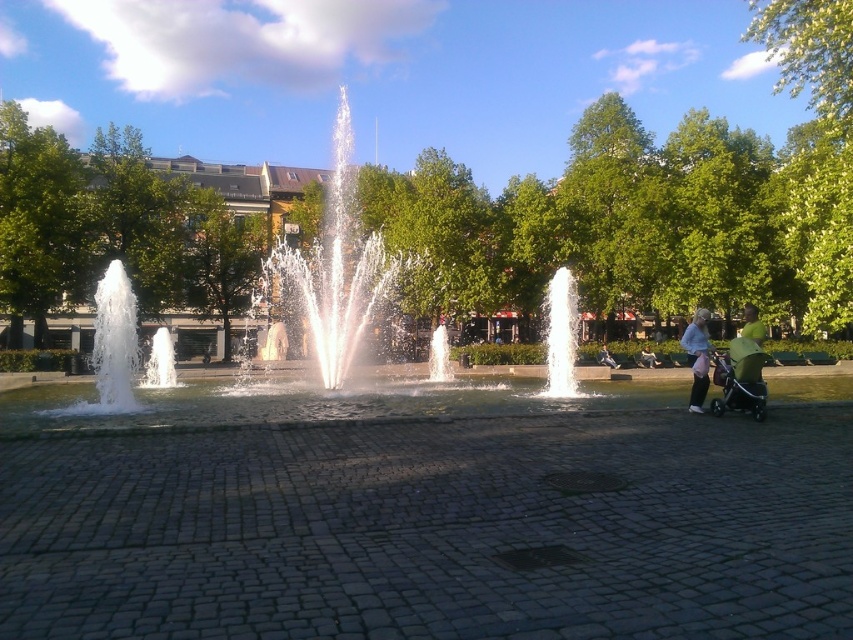
Question: Does light blue fabric jacket at lower right have a larger size compared to light blue denim jacket at lower right?

Choices:
 (A) yes
 (B) no

Answer: (A)

Question: Which object is closer to the camera taking this photo?

Choices:
 (A) green fabric jacket at right
 (B) light blue denim jacket at lower right
 (C) green fabric stroller at right
 (D) white frothy water at left

Answer: (C)

Question: Which of the following is the closest to the observer?

Choices:
 (A) (695, 396)
 (B) (549, 332)
 (C) (717, 404)

Answer: (C)

Question: Among these points, which one is farthest from the camera?

Choices:
 (A) pos(165,374)
 (B) pos(740,378)

Answer: (A)

Question: Considering the relative positions of white frothy water at left and light blue fabric jacket at lower right in the image provided, where is white frothy water at left located with respect to light blue fabric jacket at lower right?

Choices:
 (A) below
 (B) above

Answer: (B)

Question: From the image, what is the correct spatial relationship of white frothy water at left in relation to green fabric jacket at right?

Choices:
 (A) right
 (B) left

Answer: (B)